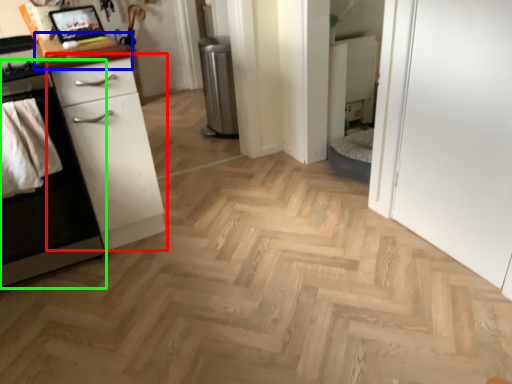
Question: Based on their relative distances, which object is farther from chest of drawers (highlighted by a red box)? Choose from counter top (highlighted by a blue box) and cabinetry (highlighted by a green box).

Choices:
 (A) counter top
 (B) cabinetry

Answer: (A)